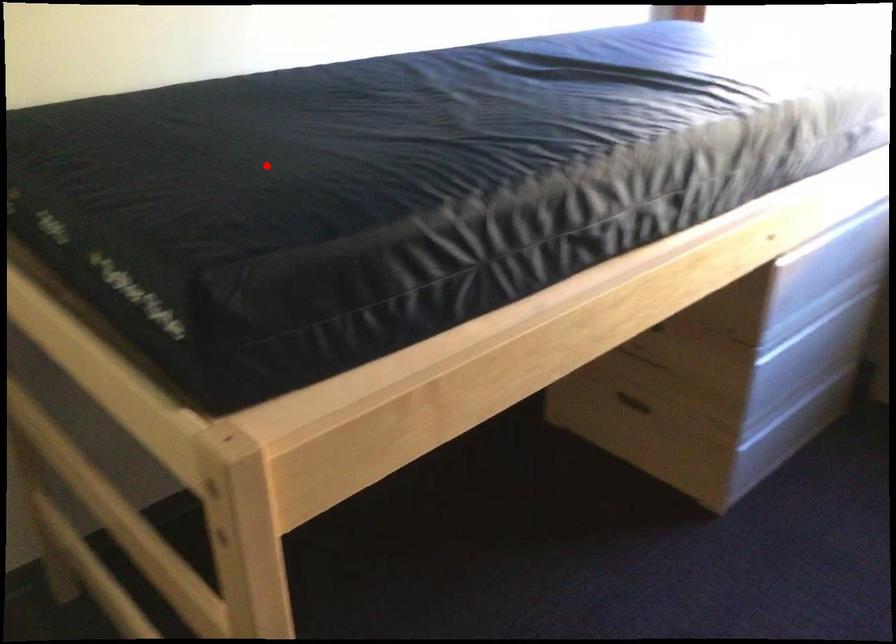
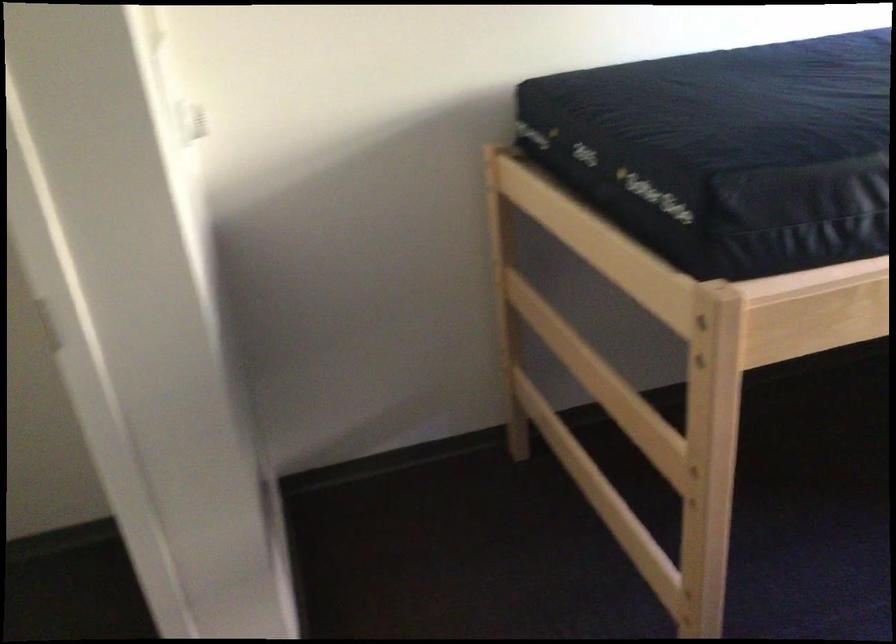
Question: I am providing you with two images of the same scene from different viewpoints. Given a red point in image1, look at the same physical point in image2. Is it:

Choices:
 (A) Closer to the viewpoint
 (B) Farther from the viewpoint

Answer: (B)